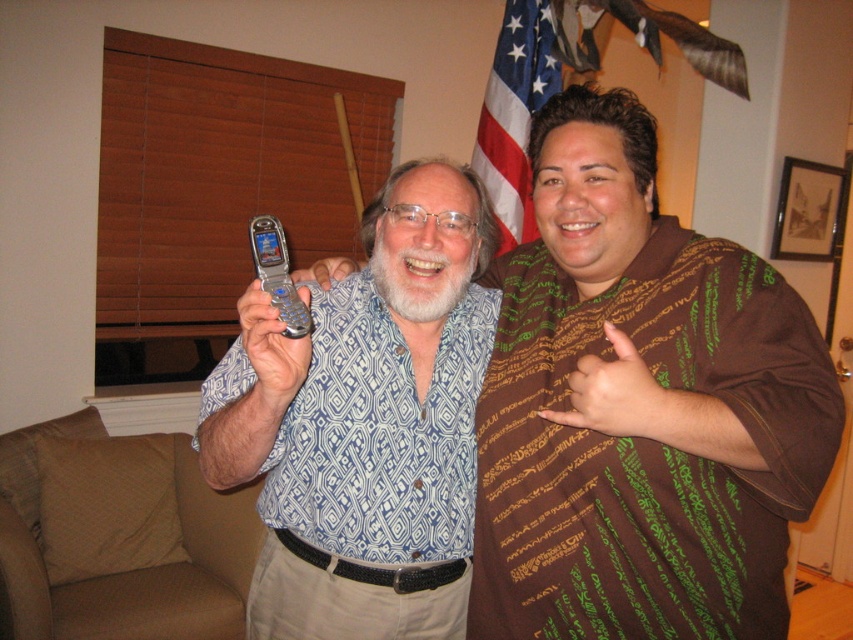
Question: Which point is closer to the camera?

Choices:
 (A) silver metallic flip phone at center
 (B) silver metallic phone at center

Answer: (A)

Question: Is silver metallic flip phone at center above american flag at upper center?

Choices:
 (A) yes
 (B) no

Answer: (B)

Question: Which point is farther to the camera?

Choices:
 (A) (305, 355)
 (B) (271, 237)
 (C) (512, 129)
 (D) (563, 288)

Answer: (C)

Question: Is american flag at upper center to the right of silver metallic phone at center from the viewer's perspective?

Choices:
 (A) no
 (B) yes

Answer: (B)

Question: Does metallic silver flip phone at center have a lesser width compared to silver metallic flip phone at center?

Choices:
 (A) yes
 (B) no

Answer: (B)

Question: Which point appears farthest from the camera in this image?

Choices:
 (A) (520, 36)
 (B) (405, 620)
 (C) (549, 596)
 (D) (253, 262)

Answer: (A)